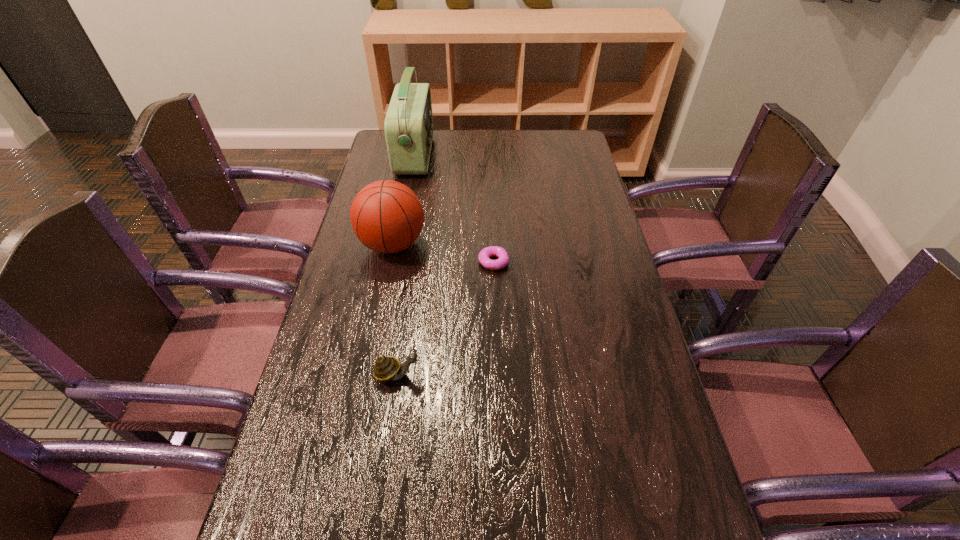
Image resolution: width=960 pixels, height=540 pixels. Identify the location of vacant point located on the left of the shortest object. (390, 262).

Find the location of a particular element. The width and height of the screenshot is (960, 540). object situated at the far edge is located at coordinates (408, 126).

Locate an element on the screen. This screenshot has height=540, width=960. radio receiver that is at the left edge is located at coordinates (408, 126).

Where is `basketball located in the left edge section of the desktop`? This screenshot has height=540, width=960. basketball located in the left edge section of the desktop is located at coordinates (386, 216).

This screenshot has height=540, width=960. I want to click on snail positioned at the left edge, so [x=386, y=368].

At what (x,y) coordinates should I click in order to perform the action: click on object at the far left corner. Please return your answer as a coordinate pair (x, y). This screenshot has width=960, height=540. Looking at the image, I should click on pyautogui.click(x=408, y=126).

In the image, there is a desktop. Where is `vacant region at the far edge`? This screenshot has height=540, width=960. vacant region at the far edge is located at coordinates (469, 144).

Where is `vacant space at the left edge of the desktop`? vacant space at the left edge of the desktop is located at coordinates (353, 252).

The image size is (960, 540). In the image, there is a desktop. In order to click on free space at the right edge in this screenshot , I will do point(585,202).

Where is `free space between the nearest object and the radio receiver`? The width and height of the screenshot is (960, 540). free space between the nearest object and the radio receiver is located at coordinates (406, 265).